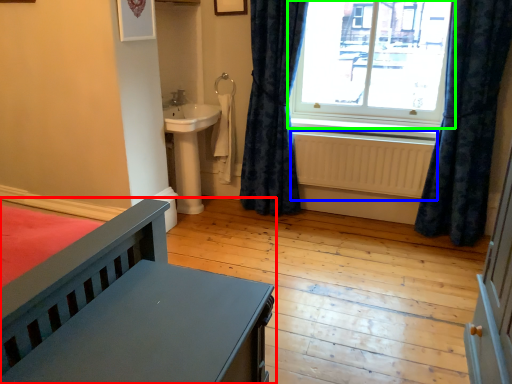
Question: Which is nearer to the furniture (highlighted by a red box)? radiator (highlighted by a blue box) or window (highlighted by a green box).

Choices:
 (A) radiator
 (B) window

Answer: (A)